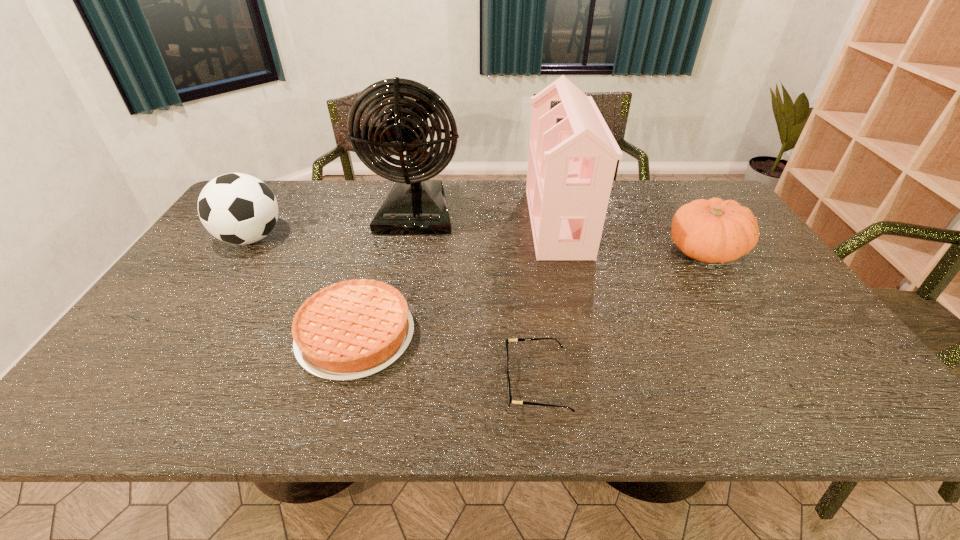
This screenshot has width=960, height=540. Find the location of `fan`. fan is located at coordinates (416, 205).

Image resolution: width=960 pixels, height=540 pixels. What are the coordinates of `dollhouse` in the screenshot? It's located at (571, 165).

This screenshot has height=540, width=960. What are the coordinates of `the third tallest object` in the screenshot? It's located at (236, 208).

I want to click on soccer ball, so click(x=236, y=208).

Image resolution: width=960 pixels, height=540 pixels. What are the coordinates of `pumpkin` in the screenshot? It's located at (713, 231).

Where is `the rightmost object`? the rightmost object is located at coordinates (713, 231).

I want to click on pie, so click(352, 329).

Find the location of a particular element. spectacles is located at coordinates (518, 339).

This screenshot has width=960, height=540. I want to click on vacant space located in front of the fan to blow air, so click(x=391, y=340).

Locate an element on the screen. The width and height of the screenshot is (960, 540). free space located 0.200m on the front-facing side of the dollhouse is located at coordinates (467, 222).